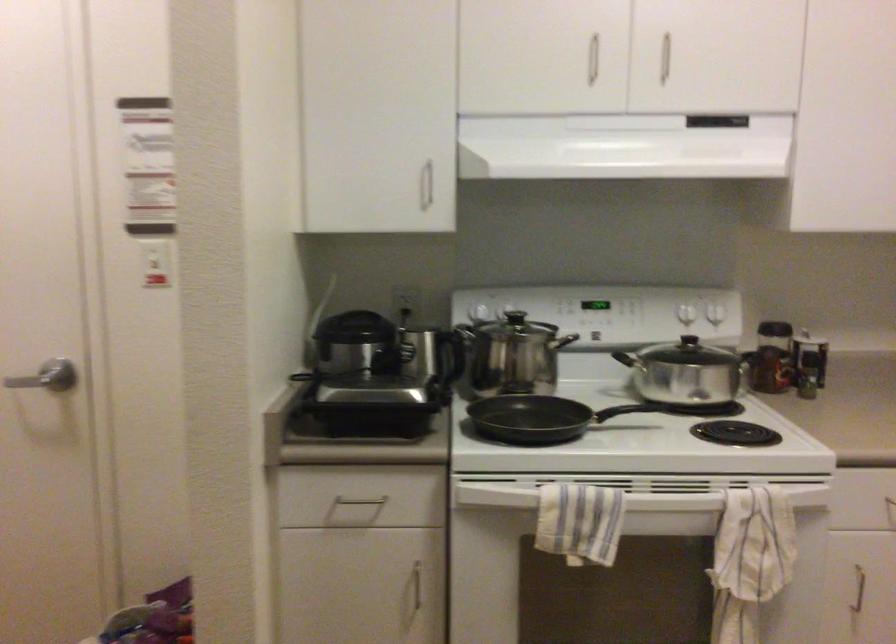
You are a GUI agent. You are given a task and a screenshot of the screen. Output one action in this format:
    pyautogui.click(x=<x>, y=<y>)
    Task: Click on the black cooker lid
    
    Given the screenshot: What is the action you would take?
    pyautogui.click(x=356, y=420)